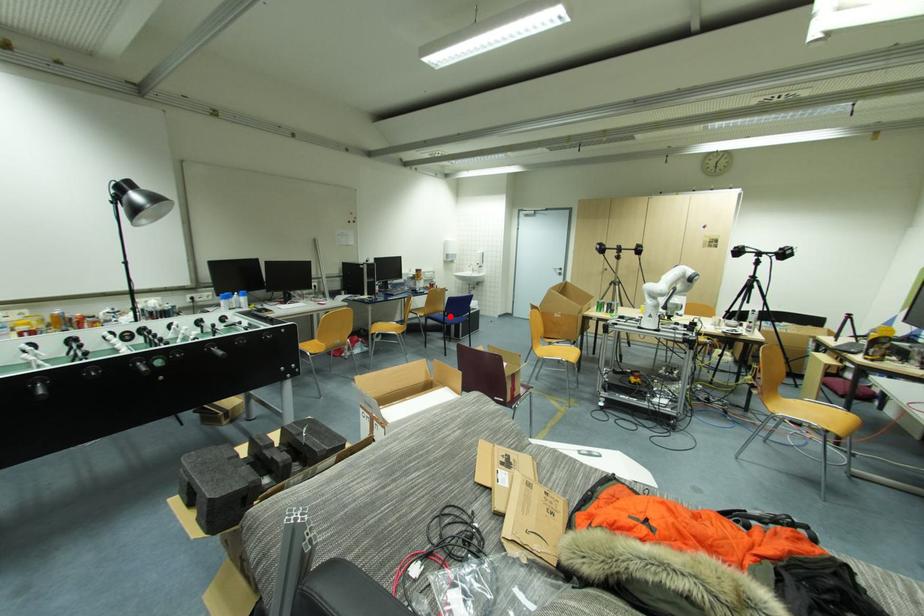
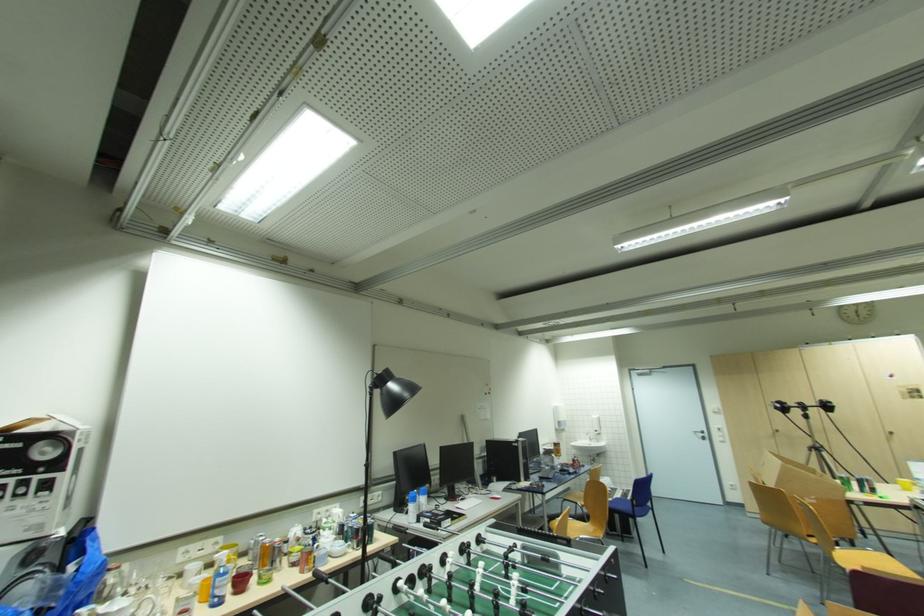
The point at the highlighted location is marked in the first image. Where is the corresponding point in the second image?

(639, 506)